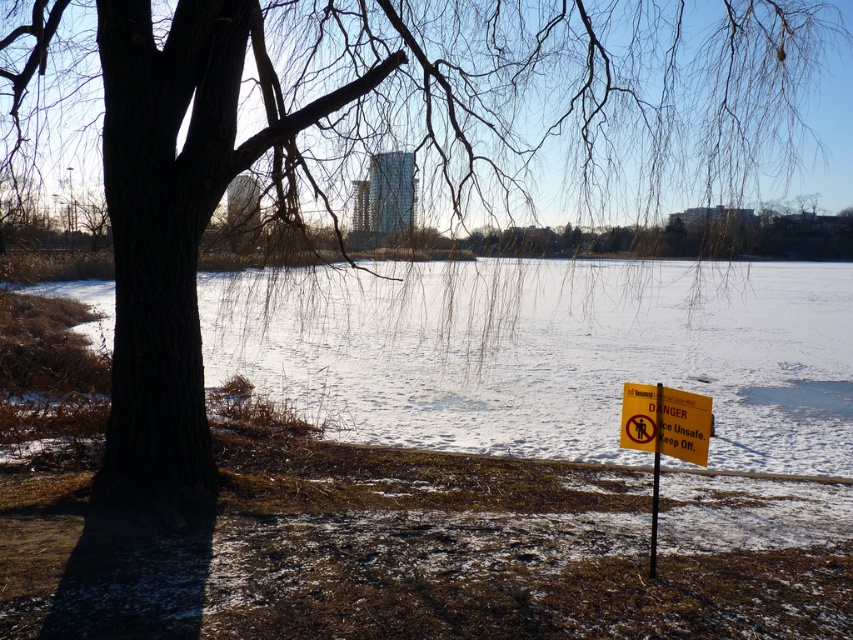
You are standing at the edge of the frozen water in the winter scene. You see the white frozen water at center and the yellow plastic sign at lower right. Which object is closer to your right side?

The yellow plastic sign at lower right is closer to your right side because it is positioned to the right of the white frozen water at center.